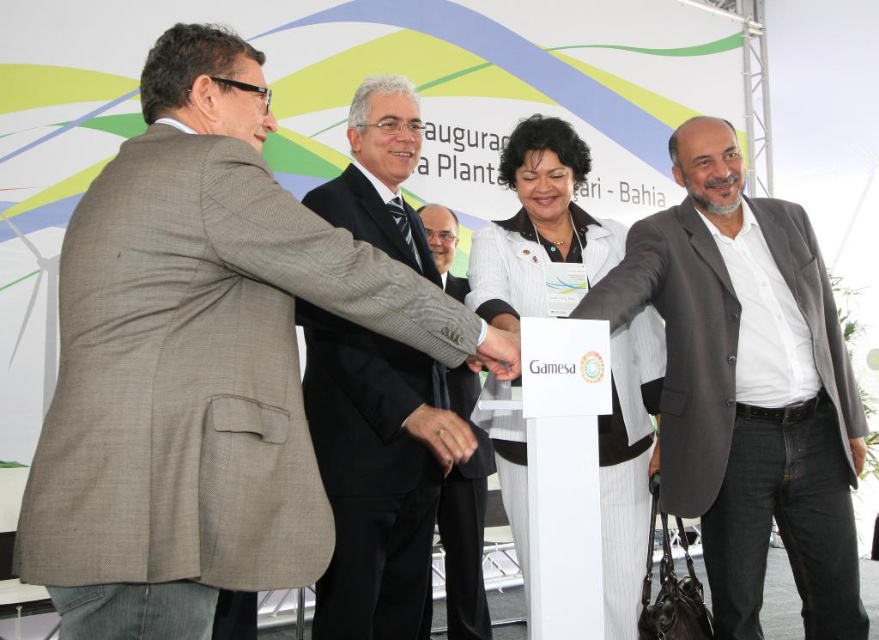
You are a photographer at the event and need to capture a group photo of the gray suit at center and gray wool blazer at center. The camera you have can only focus on subjects within a 1 meter range. Will both subjects be in focus?

The gray suit at center and gray wool blazer at center are 1.11 meters apart, which exceeds the camera focus range of 1 meter. Therefore, both subjects cannot be in focus simultaneously.